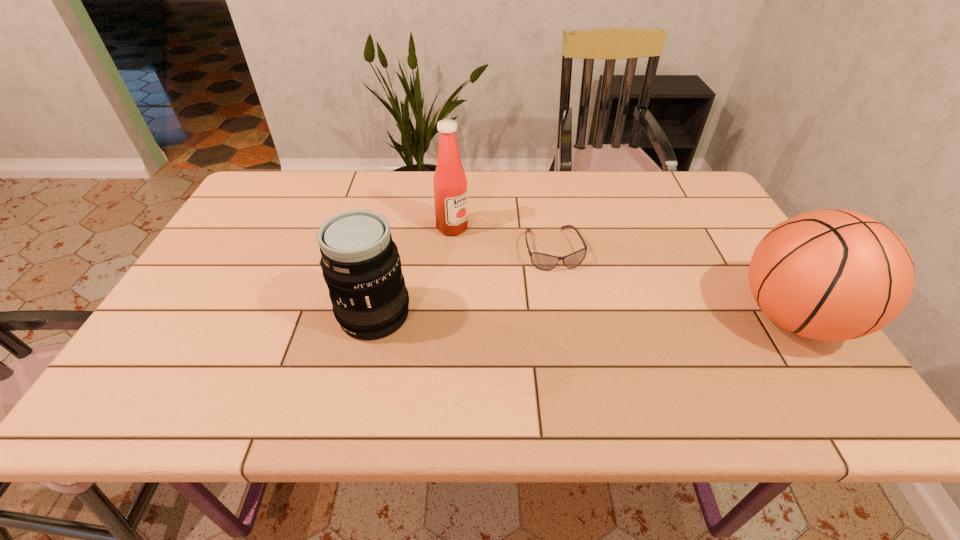
The width and height of the screenshot is (960, 540). I want to click on free space on the desktop that is between the telephoto lens and the basketball and is positioned on the front-facing side of the third object from right to left, so click(x=571, y=316).

Where is `vacant space on the desktop that is between the leftmost object and the basketball and is positioned on the lenses of the shortest object`? This screenshot has width=960, height=540. vacant space on the desktop that is between the leftmost object and the basketball and is positioned on the lenses of the shortest object is located at coordinates (579, 316).